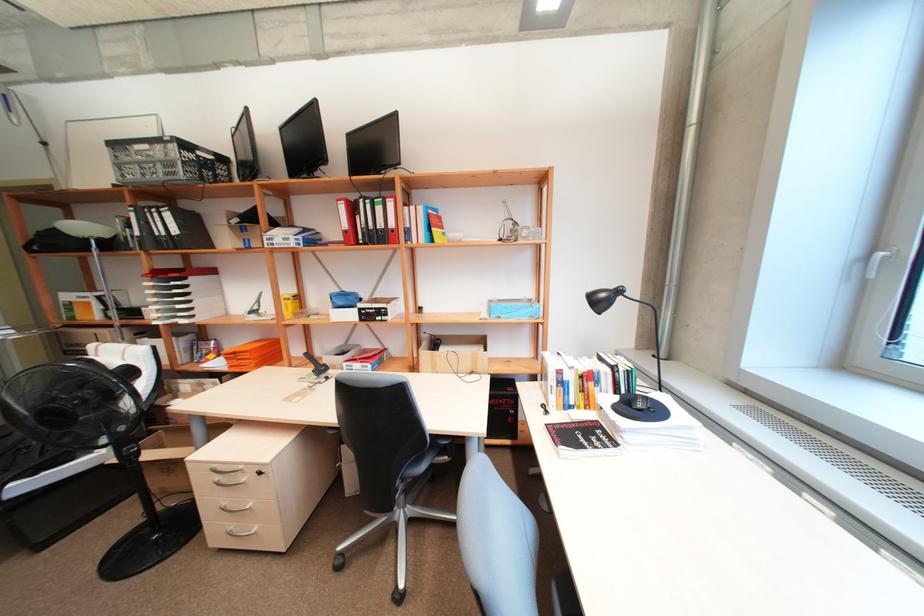
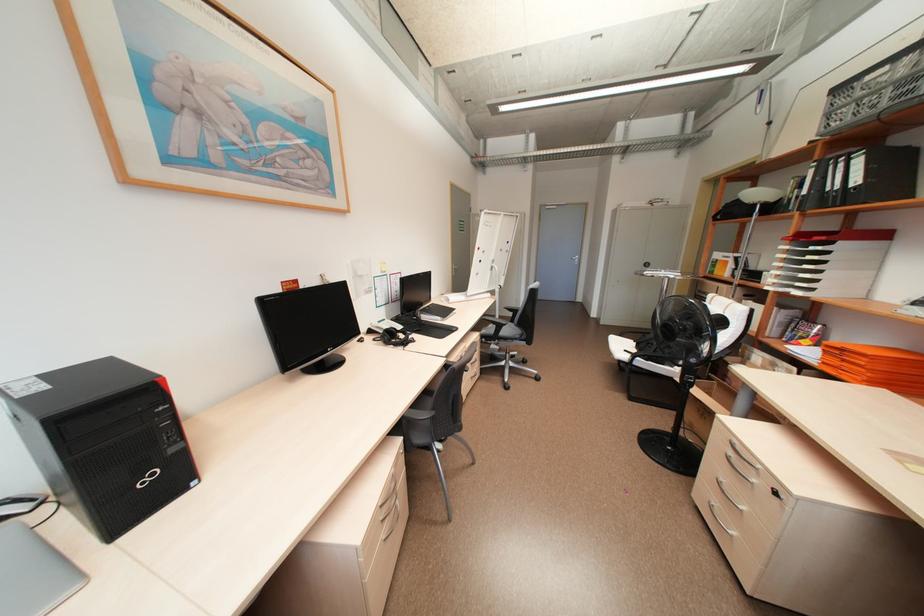
In the second image, find the point that corresponds to (x=175, y=216) in the first image.

(865, 161)